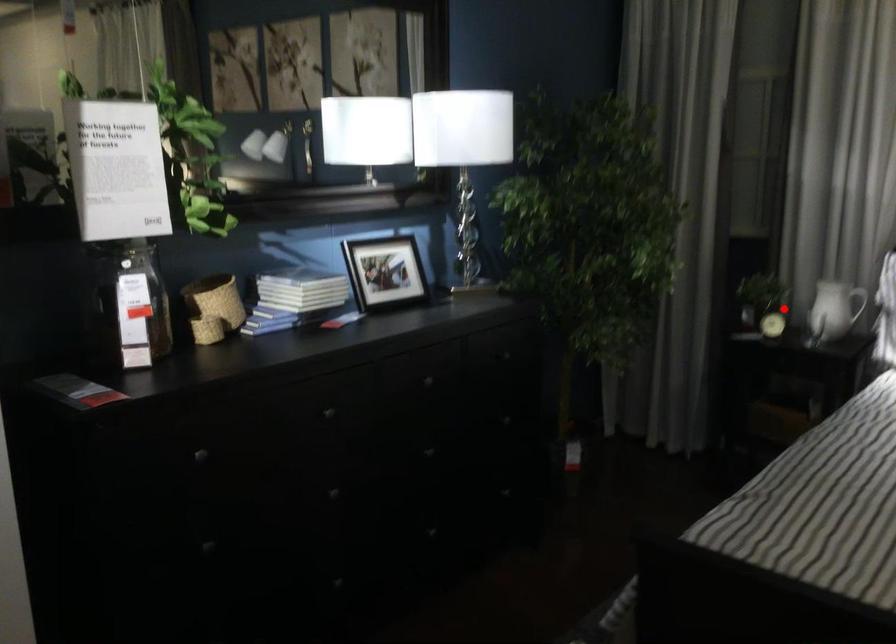
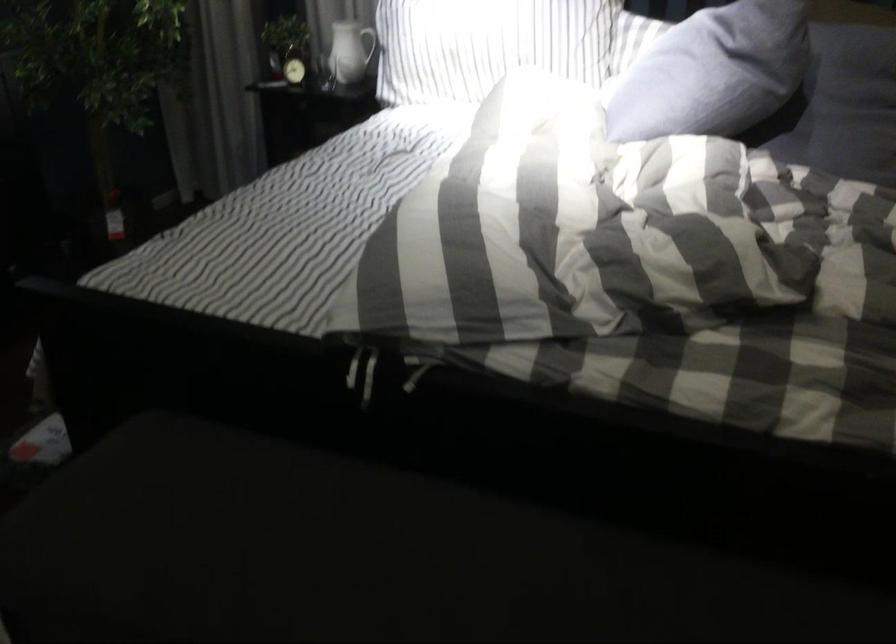
Locate, in the second image, the point that corresponds to the highlighted location in the first image.

(294, 62)